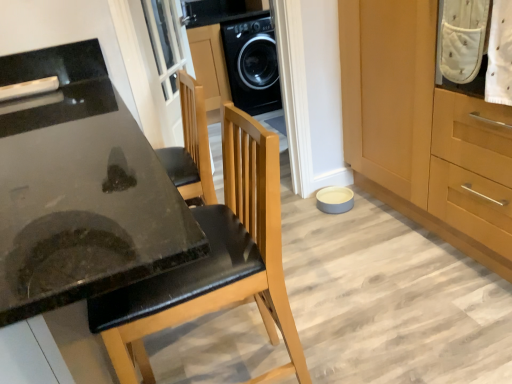
Question: Does wooden cabinet at lower right have a larger size compared to black leather chair at center?

Choices:
 (A) no
 (B) yes

Answer: (B)

Question: Is wooden cabinet at lower right positioned far away from black leather chair at center?

Choices:
 (A) no
 (B) yes

Answer: (B)

Question: Can you confirm if wooden cabinet at lower right is shorter than black leather chair at center?

Choices:
 (A) yes
 (B) no

Answer: (B)

Question: Is wooden cabinet at lower right to the right of black leather chair at center from the viewer's perspective?

Choices:
 (A) yes
 (B) no

Answer: (A)

Question: Does wooden cabinet at lower right turn towards black leather chair at center?

Choices:
 (A) no
 (B) yes

Answer: (B)

Question: In the image, is black glossy washing machine at center positioned in front of or behind white glass screen door at upper center?

Choices:
 (A) front
 (B) behind

Answer: (B)

Question: Considering the relative positions of black glossy washing machine at center and white glass screen door at upper center in the image provided, is black glossy washing machine at center to the left or to the right of white glass screen door at upper center?

Choices:
 (A) left
 (B) right

Answer: (B)

Question: Is black glossy washing machine at center wider or thinner than white glass screen door at upper center?

Choices:
 (A) wide
 (B) thin

Answer: (A)

Question: In terms of size, does black glossy washing machine at center appear bigger or smaller than white glass screen door at upper center?

Choices:
 (A) big
 (B) small

Answer: (A)

Question: Is black glossy washing machine at center bigger or smaller than wooden cabinet at lower right?

Choices:
 (A) small
 (B) big

Answer: (A)

Question: Is black glossy washing machine at center wider or thinner than wooden cabinet at lower right?

Choices:
 (A) wide
 (B) thin

Answer: (B)

Question: Is black glossy washing machine at center taller or shorter than wooden cabinet at lower right?

Choices:
 (A) tall
 (B) short

Answer: (B)

Question: Is black glossy washing machine at center in front of or behind wooden cabinet at lower right in the image?

Choices:
 (A) front
 (B) behind

Answer: (B)

Question: Considering the positions of white dotted fabric at upper right and black glossy countertop at lower left in the image, is white dotted fabric at upper right taller or shorter than black glossy countertop at lower left?

Choices:
 (A) short
 (B) tall

Answer: (A)

Question: Is point (494, 77) positioned closer to the camera than point (73, 62)?

Choices:
 (A) farther
 (B) closer

Answer: (B)